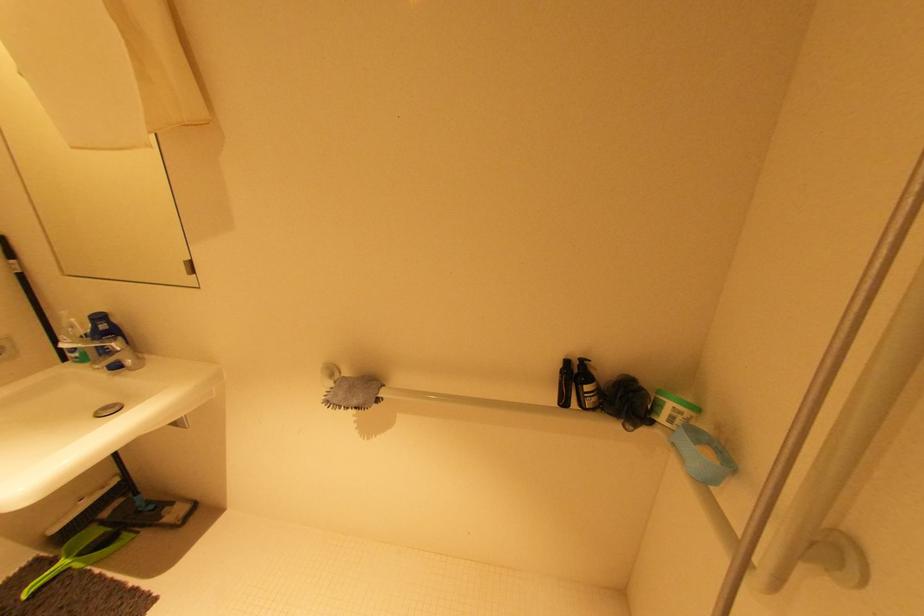
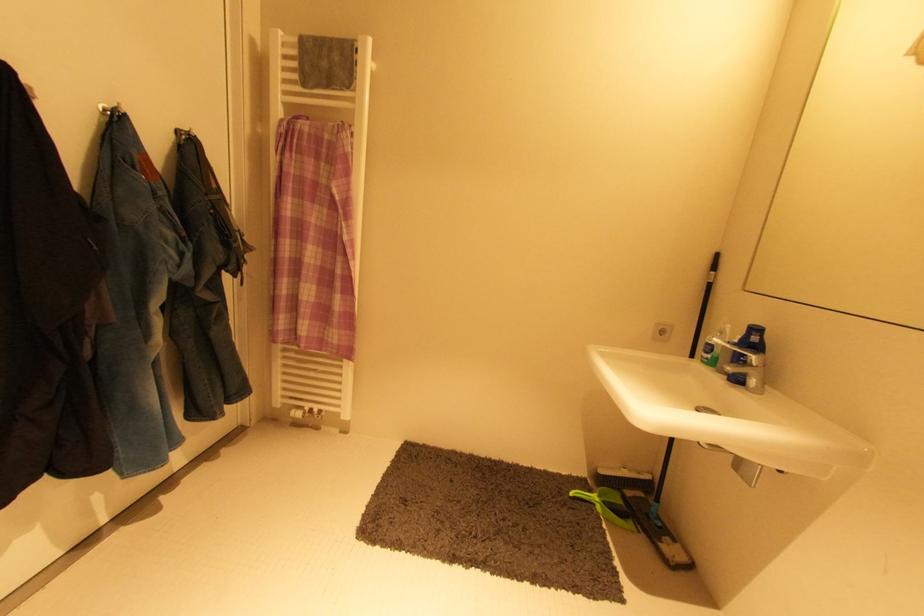
Question: The images are taken continuously from a first-person perspective. In which direction is your viewpoint rotating?

Choices:
 (A) Left
 (B) Right
 (C) Up
 (D) Down

Answer: (A)